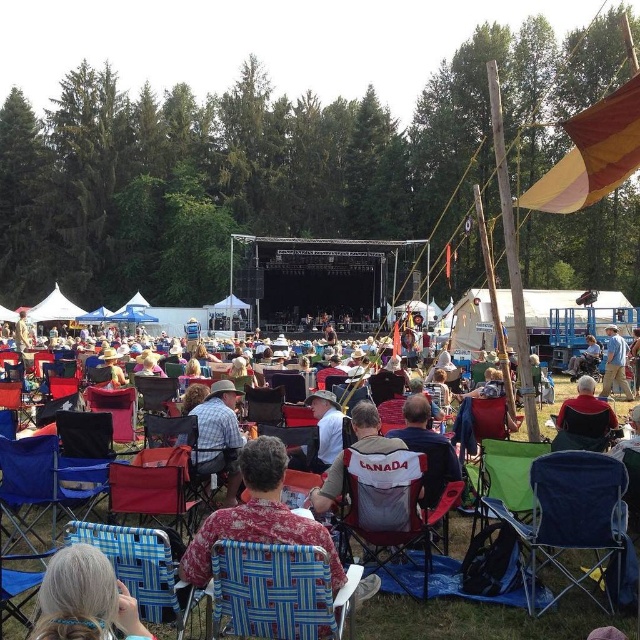
Question: Among these objects, which one is nearest to the camera?

Choices:
 (A) green fabric chair at lower right
 (B) blue woven fabric chair at lower left
 (C) gray fabric chair at lower left

Answer: (C)

Question: Does gray fabric chair at lower left have a greater width compared to blue woven fabric chair at center?

Choices:
 (A) no
 (B) yes

Answer: (A)

Question: Which point is farther from the camera taking this photo?

Choices:
 (A) (340, 474)
 (B) (317, 412)
 (C) (204, 524)

Answer: (B)

Question: Is blue woven fabric chair at center thinner than plaid shirt at center?

Choices:
 (A) no
 (B) yes

Answer: (A)

Question: Which of the following is the farthest from the observer?

Choices:
 (A) plaid shirt at center
 (B) blue denim jeans at right
 (C) blue woven fabric chair at lower left
 (D) blue fabric folding chair at center

Answer: (B)

Question: Is blue woven fabric chair at lower center wider than blue fabric folding chair at center?

Choices:
 (A) yes
 (B) no

Answer: (B)